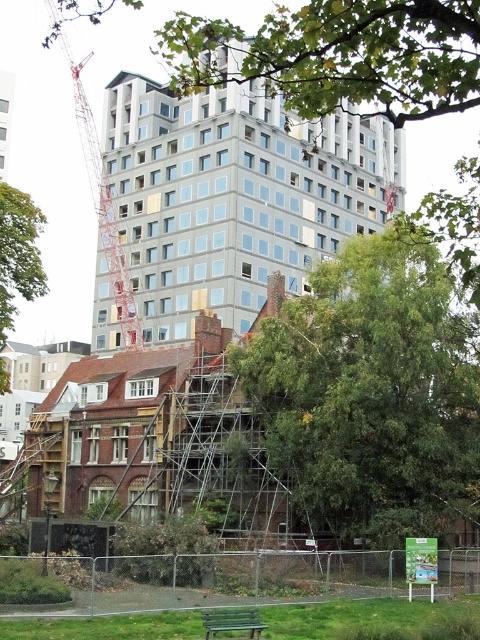
You are an urban planner reviewing this construction site. You notice two green leafy trees in the image. Which tree, the green leafy tree at upper center or the green leafy tree at left, is closer to the observer?

The green leafy tree at upper center is closer to the observer because it is in front of the green leafy tree at left.

You are a construction worker observing the urban scene. You notice the metallic red crane at upper left and the green leafy tree at left. Which object is positioned higher in the image?

The metallic red crane at upper left is located above the green leafy tree at left, so it is positioned higher in the image.